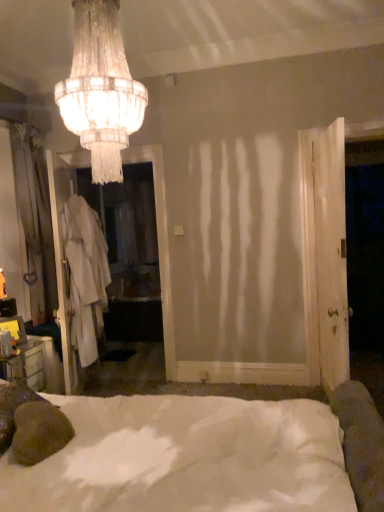
From the picture: Measure the distance between point (313, 140) and camera.

Point (313, 140) is 3.20 meters away from camera.

Image resolution: width=384 pixels, height=512 pixels. I want to click on white fabric screen door at left, so click(160, 245).

Locate an element on the screen. white soft bed at center is located at coordinates (187, 457).

I want to click on white fabric robe at left, so click(85, 275).

Is white fabric robe at left taller or shorter than white soft bed at center?

white fabric robe at left is taller than white soft bed at center.

Is white fabric robe at left oriented towards white soft bed at center?

No, white fabric robe at left is not aimed at white soft bed at center.

From a real-world perspective, between white fabric robe at left and white soft bed at center, who is vertically higher?

In real-world perspective, white fabric robe at left is above.

From the image's perspective, which is above, white fabric robe at left or white soft bed at center?

white fabric robe at left is shown above in the image.

Between white soft bed at center and white fabric screen door at left, which one has larger width?

With larger width is white soft bed at center.

Is white soft bed at center inside or outside of white fabric screen door at left?

white soft bed at center is located beyond the bounds of white fabric screen door at left.

From the image's perspective, is white soft bed at center positioned above or below white fabric screen door at left?

Clearly, from the image's perspective, white soft bed at center is below white fabric screen door at left.

Is white fabric screen door at left positioned with its back to white soft bed at center?

No, white soft bed at center is not at the back of white fabric screen door at left.

Considering the positions of objects white fabric screen door at left and white soft bed at center in the image provided, who is more to the left, white fabric screen door at left or white soft bed at center?

From the viewer's perspective, white fabric screen door at left appears more on the left side.

Is white fabric screen door at left not within white soft bed at center?

Yes, white fabric screen door at left is outside of white soft bed at center.

Relative to white soft bed at center, is white fabric screen door at left in front or behind?

white fabric screen door at left is positioned farther from the viewer than white soft bed at center.

Is there a large distance between white fabric screen door at left and white wood door at right?

white fabric screen door at left is far away from white wood door at right.

Which is behind, point (76, 166) or point (337, 255)?

The point (76, 166) is farther.

This screenshot has width=384, height=512. What are the coordinates of `screen door located above the white wood door at right (from the image's perspective)` in the screenshot? It's located at (160, 245).

Can you confirm if white fabric screen door at left is smaller than white wood door at right?

Actually, white fabric screen door at left might be larger than white wood door at right.

Is white wood door at right inside or outside of white soft bed at center?

white wood door at right is outside white soft bed at center.

From a real-world perspective, between white wood door at right and white soft bed at center, who is vertically lower?

white soft bed at center is physically lower.

At what (x,y) coordinates should I click in order to perform the action: click on bed below the white wood door at right (from a real-world perspective). Please return your answer as a coordinate pair (x, y). The image size is (384, 512). Looking at the image, I should click on (187, 457).

Is white wood door at right in front of or behind white soft bed at center in the image?

In the image, white wood door at right appears behind white soft bed at center.

Considering the positions of point (99, 271) and point (112, 145), is point (99, 271) closer or farther from the camera than point (112, 145)?

Point (99, 271) appears to be farther away from the viewer than point (112, 145).

From the image's perspective, is white fabric robe at left on top of crystal glass chandelier at upper center?

No, from the image's perspective, white fabric robe at left is not on top of crystal glass chandelier at upper center.

Is white fabric robe at left at the right side of crystal glass chandelier at upper center?

No.

Is white soft bed at center aimed at white wood door at right?

No, white soft bed at center is not turned towards white wood door at right.

Who is taller, white soft bed at center or white wood door at right?

With more height is white wood door at right.

From the image's perspective, which object appears higher, white soft bed at center or white wood door at right?

white wood door at right appears higher in the image.

Is white soft bed at center not near white wood door at right?

Indeed, white soft bed at center is not near white wood door at right.

I want to click on bed that appears below the white fabric robe at left (from the image's perspective), so click(x=187, y=457).

The image size is (384, 512). Identify the location of screen door on the left of the white soft bed at center. (160, 245).

Estimate the real-world distances between objects in this image. Which object is further from white fabric screen door at left, white fabric robe at left or crystal glass chandelier at upper center?

The object further to white fabric screen door at left is crystal glass chandelier at upper center.

Based on their spatial positions, is white wood door at right or white soft bed at center further from white fabric robe at left?

Based on the image, white wood door at right appears to be further to white fabric robe at left.

Considering their positions, is white fabric robe at left positioned closer to crystal glass chandelier at upper center than white wood door at right?

Among the two, white fabric robe at left is located nearer to crystal glass chandelier at upper center.

Considering their positions, is crystal glass chandelier at upper center positioned closer to white fabric screen door at left than white wood door at right?

Among the two, white wood door at right is located nearer to white fabric screen door at left.

From the image, which object appears to be farther from white soft bed at center, white fabric robe at left or white wood door at right?

Among the two, white wood door at right is located further to white soft bed at center.

When comparing their distances from white wood door at right, does white soft bed at center or white fabric screen door at left seem closer?

white fabric screen door at left lies closer to white wood door at right than the other object.

When comparing their distances from white wood door at right, does white fabric robe at left or white soft bed at center seem closer?

white fabric robe at left.

Considering their positions, is white fabric screen door at left positioned closer to white wood door at right than white soft bed at center?

white fabric screen door at left lies closer to white wood door at right than the other object.

Image resolution: width=384 pixels, height=512 pixels. Identify the location of lamp between white fabric robe at left and white wood door at right in the horizontal direction. (101, 89).

Find the location of a particular element. The height and width of the screenshot is (512, 384). robe between crystal glass chandelier at upper center and white fabric screen door at left in the front-back direction is located at coordinates (85, 275).

At what (x,y) coordinates should I click in order to perform the action: click on door between white soft bed at center and white fabric robe at left in the front-back direction. Please return your answer as a coordinate pair (x, y). The width and height of the screenshot is (384, 512). Looking at the image, I should click on (331, 253).

This screenshot has height=512, width=384. In order to click on robe positioned between white soft bed at center and white fabric screen door at left from near to far in this screenshot , I will do `click(85, 275)`.